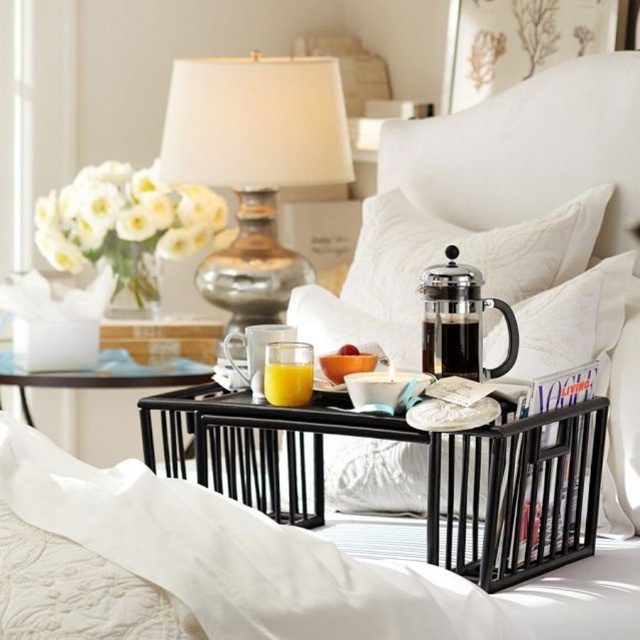
You are standing at the foot of the bed and want to place a new item on the tray table. If you look at the two points on the tray table labeled as point (378, 268) and point (358, 352), which point is closer to you?

Point (378, 268) is closer to you because it is further to the viewer than point (358, 352).

You are standing at the foot of the bed and want to place a book on the tray table. Which point, point (385, 436) or point (125, 394), is closer to the tray table?

Point (385, 436) is closer to the tray table because it is in front of point (125, 394), meaning it is nearer to the observer standing at the foot of the bed.